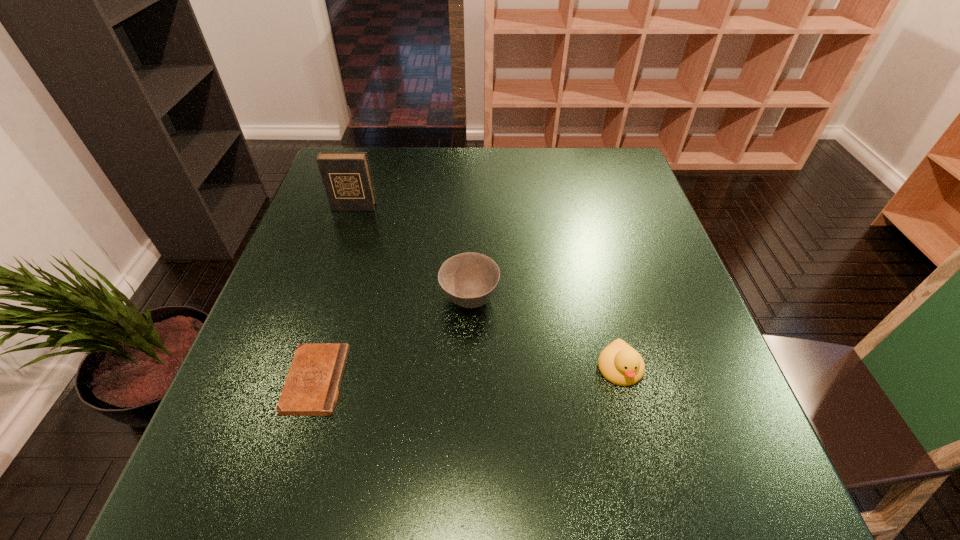
I want to click on vacant area that satisfies the following two spatial constraints: 1. on the face of the rightmost object; 2. on the spine side of the nearer diary, so click(623, 380).

Identify the location of vacant area in the image that satisfies the following two spatial constraints: 1. on the face of the duckling; 2. on the spine side of the shorter diary. (623, 380).

The image size is (960, 540). What are the coordinates of `free location that satisfies the following two spatial constraints: 1. on the face of the duckling; 2. on the spine side of the nearer diary` in the screenshot? It's located at (623, 380).

Locate an element on the screen. The image size is (960, 540). vacant area that satisfies the following two spatial constraints: 1. on the front side of the third nearest object; 2. on the spine side of the shortest object is located at coordinates (468, 380).